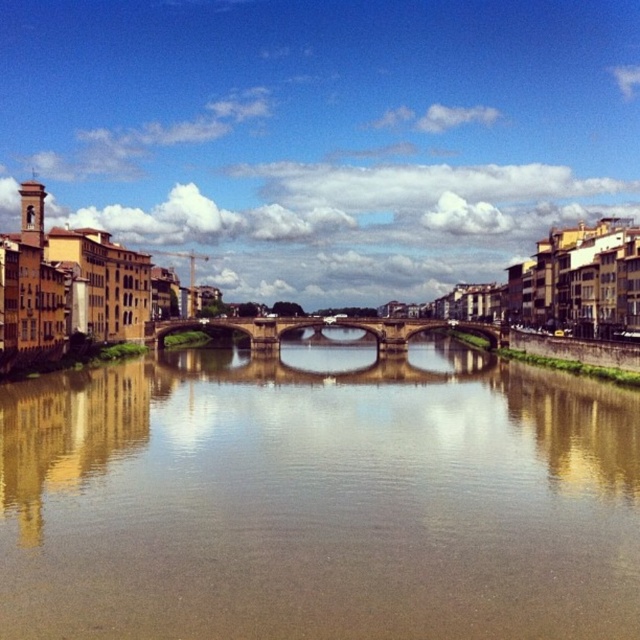
Who is more forward, (317, 408) or (275, 326)?

Point (317, 408) is in front.

Is brown reflective water at center shorter than stone arch bridge at center?

No.

Is point (580, 502) less distant than point (256, 346)?

Yes, it is in front of point (256, 346).

Image resolution: width=640 pixels, height=640 pixels. I want to click on brown reflective water at center, so click(317, 499).